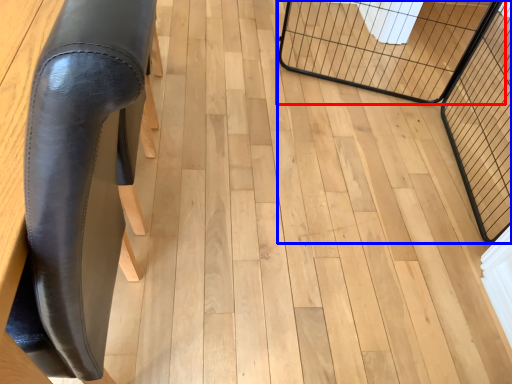
Question: Which point is further to the camera, cage (highlighted by a red box) or cage (highlighted by a blue box)?

Choices:
 (A) cage
 (B) cage

Answer: (A)